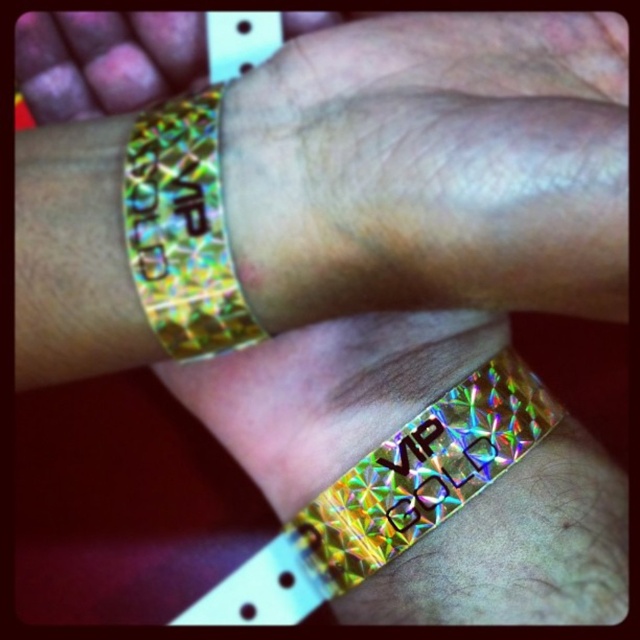
You are a bouncer at a VIP entrance. You need to check the distance between the holographic vip wristband at center and the holographic gold wristband at upper center to ensure they are not too close. The minimum required distance is 10 inches. Can the person enter?

The distance between the holographic vip wristband at center and the holographic gold wristband at upper center is 10.80 inches, which exceeds the minimum required distance of 10 inches. Therefore, the person can enter.

Looking at this image, you are a security guard at a VIP event and need to check the holographic vip wristband at center. If your hand is 20 centimeters long, can you reach it from your current position without moving closer?

The holographic vip wristband at center is 63.87 centimeters away from the viewer. Since your hand is only 20 centimeters long, you cannot reach it without moving closer.

You are a security guard at a VIP event and need to check the wristbands. The holographic vip wristband at center is on a guest, and the holographic gold wristband at upper center is on another guest. Which wristband is wider?

The holographic vip wristband at center is wider than the holographic gold wristband at upper center.